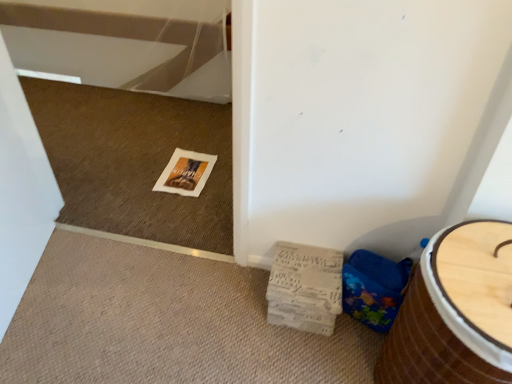
Identify the location of white cardboard magazine at lower right. (305, 288).

Identify the location of blue fabric potty at lower right. The width and height of the screenshot is (512, 384). point(374,288).

You are a GUI agent. You are given a task and a screenshot of the screen. Output one action in this format:
    pyautogui.click(x=<x>, y=<y>)
    Task: Click on the white cardboard magazine at lower right
    Image resolution: width=512 pixels, height=384 pixels.
    Given the screenshot: What is the action you would take?
    pyautogui.click(x=305, y=288)

Which object is thinner, blue fabric potty at lower right or white cardboard magazine at lower right?

blue fabric potty at lower right is thinner.

Would you say blue fabric potty at lower right is to the left or to the right of white cardboard magazine at lower right in the picture?

In the image, blue fabric potty at lower right appears on the right side of white cardboard magazine at lower right.

Can you see blue fabric potty at lower right touching white cardboard magazine at lower right?

No, blue fabric potty at lower right is not next to white cardboard magazine at lower right.

Can you tell me how much blue fabric potty at lower right and white cardboard magazine at lower right differ in facing direction?

The facing directions of blue fabric potty at lower right and white cardboard magazine at lower right are 0.000848 degrees apart.

Between wooden barrel at lower right and blue fabric potty at lower right, which one has smaller width?

With smaller width is blue fabric potty at lower right.

Which object is further away from the camera, wooden barrel at lower right or blue fabric potty at lower right?

blue fabric potty at lower right is further away from the camera.

Can you confirm if wooden barrel at lower right is smaller than blue fabric potty at lower right?

Incorrect, wooden barrel at lower right is not smaller in size than blue fabric potty at lower right.

Is point (423, 377) closer or farther from the camera than point (365, 290)?

Clearly, point (423, 377) is closer to the camera than point (365, 290).

Is blue fabric potty at lower right at the back of white cardboard magazine at lower right?

white cardboard magazine at lower right is not turned away from blue fabric potty at lower right.

The image size is (512, 384). I want to click on magazine above the blue fabric potty at lower right (from the image's perspective), so click(x=305, y=288).

Is white cardboard magazine at lower right taller or shorter than blue fabric potty at lower right?

Clearly, white cardboard magazine at lower right is shorter compared to blue fabric potty at lower right.

Is white cardboard magazine at lower right at the left side of blue fabric potty at lower right?

Yes, white cardboard magazine at lower right is to the left of blue fabric potty at lower right.

Considering the relative sizes of white cardboard magazine at lower right and wooden barrel at lower right in the image provided, is white cardboard magazine at lower right smaller than wooden barrel at lower right?

Yes, white cardboard magazine at lower right is smaller than wooden barrel at lower right.

Is white cardboard magazine at lower right next to wooden barrel at lower right and touching it?

white cardboard magazine at lower right is not next to wooden barrel at lower right, and they're not touching.

Which of these two, white cardboard magazine at lower right or wooden barrel at lower right, is wider?

wooden barrel at lower right.

Considering the relative positions of white cardboard magazine at lower right and wooden barrel at lower right in the image provided, is white cardboard magazine at lower right to the right of wooden barrel at lower right from the viewer's perspective?

No.

Can you tell me how much blue fabric potty at lower right and wooden barrel at lower right differ in facing direction?

0.000608 degrees separate the facing orientations of blue fabric potty at lower right and wooden barrel at lower right.

Is the depth of blue fabric potty at lower right less than that of wooden barrel at lower right?

No.

In order to click on potty directly beneath the wooden barrel at lower right (from a real-world perspective) in this screenshot , I will do `click(374, 288)`.

Considering the sizes of objects blue fabric potty at lower right and wooden barrel at lower right in the image provided, who is smaller, blue fabric potty at lower right or wooden barrel at lower right?

blue fabric potty at lower right is smaller.

What's the angular difference between wooden barrel at lower right and white cardboard magazine at lower right's facing directions?

The angular difference between wooden barrel at lower right and white cardboard magazine at lower right is 0.00143 degrees.

From a real-world perspective, is wooden barrel at lower right over white cardboard magazine at lower right?

Yes, from a real-world perspective, wooden barrel at lower right is above white cardboard magazine at lower right.

Are wooden barrel at lower right and white cardboard magazine at lower right making contact?

No, wooden barrel at lower right is not with white cardboard magazine at lower right.

Considering the points (467, 291) and (315, 330), which point is behind, point (467, 291) or point (315, 330)?

Point (315, 330)

Locate an element on the screen. The image size is (512, 384). magazine below the blue fabric potty at lower right (from a real-world perspective) is located at coordinates (305, 288).

You are a GUI agent. You are given a task and a screenshot of the screen. Output one action in this format:
    pyautogui.click(x=<x>, y=<y>)
    Task: Click on the furniture in front of the blue fabric potty at lower right
    The image size is (512, 384).
    Given the screenshot: What is the action you would take?
    [455, 311]

From the image, which object appears to be farther from wooden barrel at lower right, blue fabric potty at lower right or white cardboard magazine at lower right?

white cardboard magazine at lower right is positioned further to the anchor wooden barrel at lower right.

Consider the image. Based on their spatial positions, is wooden barrel at lower right or blue fabric potty at lower right closer to white cardboard magazine at lower right?

The object closer to white cardboard magazine at lower right is blue fabric potty at lower right.

When comparing their distances from wooden barrel at lower right, does white cardboard magazine at lower right or blue fabric potty at lower right seem closer?

Based on the image, blue fabric potty at lower right appears to be nearer to wooden barrel at lower right.

Which object lies nearer to the anchor point white cardboard magazine at lower right, blue fabric potty at lower right or wooden barrel at lower right?

Among the two, blue fabric potty at lower right is located nearer to white cardboard magazine at lower right.

Looking at the image, which one is located closer to blue fabric potty at lower right, wooden barrel at lower right or white cardboard magazine at lower right?

The object closer to blue fabric potty at lower right is white cardboard magazine at lower right.

Estimate the real-world distances between objects in this image. Which object is closer to blue fabric potty at lower right, white cardboard magazine at lower right or wooden barrel at lower right?

white cardboard magazine at lower right lies closer to blue fabric potty at lower right than the other object.

Locate an element on the screen. The width and height of the screenshot is (512, 384). potty between wooden barrel at lower right and white cardboard magazine at lower right from front to back is located at coordinates (374, 288).